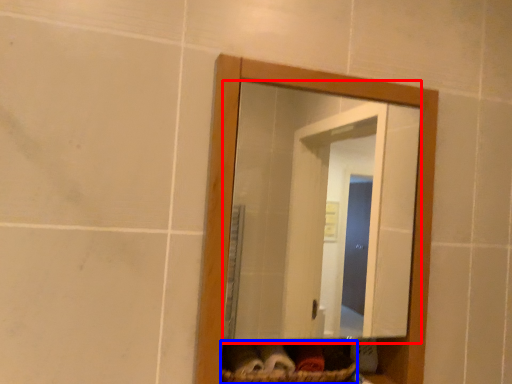
Question: Which of the following is the closest to the observer, mirror (highlighted by a red box) or basket (highlighted by a blue box)?

Choices:
 (A) mirror
 (B) basket

Answer: (A)